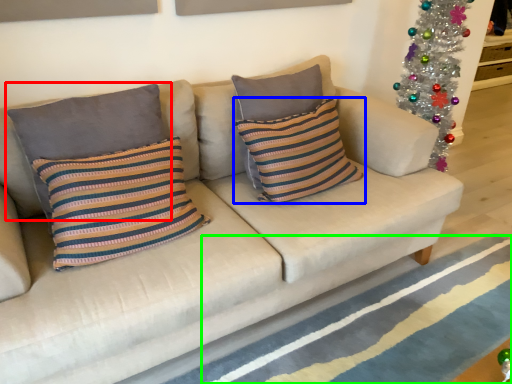
Question: Based on their relative distances, which object is nearer to pillow (highlighted by a red box)? Choose from pillow (highlighted by a blue box) and stripe (highlighted by a green box).

Choices:
 (A) pillow
 (B) stripe

Answer: (A)